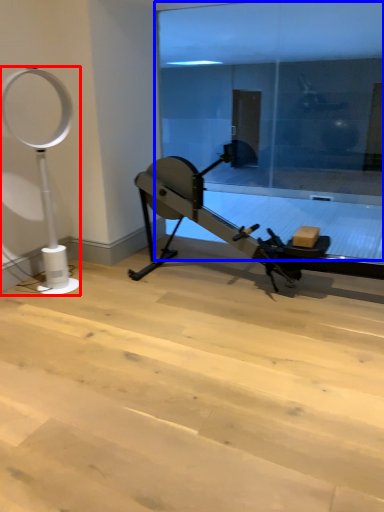
Question: Which of the following is the closest to the observer, basketball hoop (highlighted by a red box) or glass door (highlighted by a blue box)?

Choices:
 (A) basketball hoop
 (B) glass door

Answer: (A)